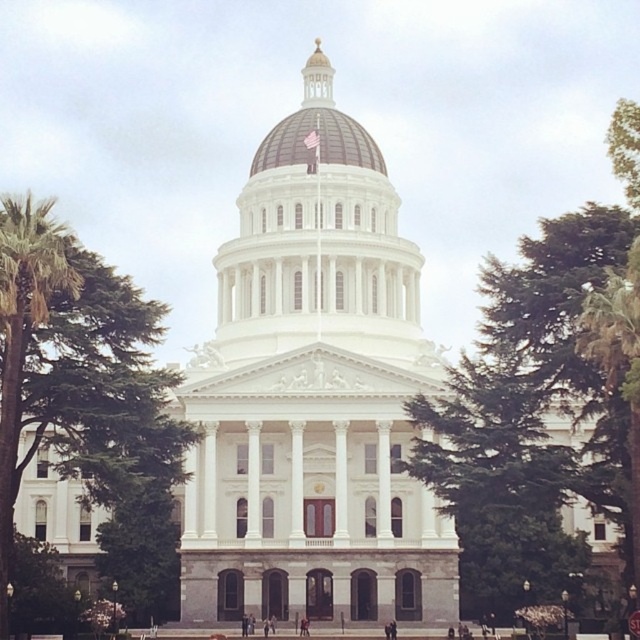
You are standing in front of the grand neoclassical building and want to know which object is taller between the green leafy tree at center and the brown domed roof at center. Can you determine this based on the scene?

The green leafy tree at center has a greater height compared to the brown domed roof at center, so the green leafy tree at center is taller.

You are standing in front of the grand neoclassical building and want to walk towards the green leafy tree at center and the green leafy tree at left. Which tree should you walk towards if you want to reach the one that is closer to you first?

You should walk towards the green leafy tree at center first because it is closer to the viewer than the green leafy tree at left.

Looking at this image, you are an architect analyzing the proportions of the building and its surroundings. Given the green leafy tree at left and the brown domed roof at center, which object has a greater width when viewed from your perspective?

The green leafy tree at left has a greater width than the brown domed roof at center.